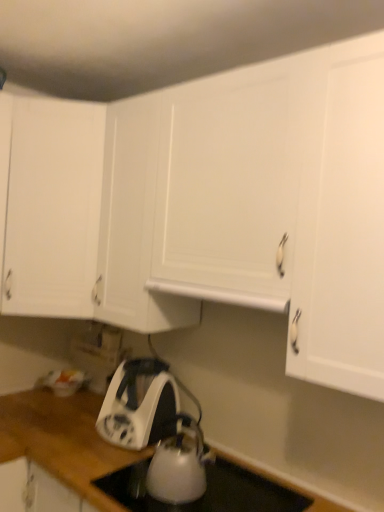
What do you see at coordinates (206, 490) in the screenshot? The image size is (384, 512). I see `white glossy kettle at lower center` at bounding box center [206, 490].

At what (x,y) coordinates should I click in order to perform the action: click on white matte cabinet at upper left. Please return your answer as a coordinate pair (x, y). The image size is (384, 512). Looking at the image, I should click on (52, 208).

Identify the location of white matte exhaust hood at center. (219, 295).

Where is `white glossy kettle at lower center`? The image size is (384, 512). white glossy kettle at lower center is located at coordinates (206, 490).

Looking at their sizes, would you say white matte cabinet at upper left is wider or thinner than white glossy kettle at lower center?

Clearly, white matte cabinet at upper left has more width compared to white glossy kettle at lower center.

Where is `gas stove on the right of white matte cabinet at upper left`? gas stove on the right of white matte cabinet at upper left is located at coordinates (206, 490).

Does white matte cabinet at upper left have a smaller size compared to white glossy kettle at lower center?

No.

Is point (89, 317) closer to camera compared to point (207, 493)?

No.

How different are the orientations of white glossy kettle at lower center and white matte cabinet at upper left in degrees?

The facing directions of white glossy kettle at lower center and white matte cabinet at upper left are 46.4 degrees apart.

Does point (183, 480) lie behind point (34, 189)?

No, it is in front of (34, 189).

Based on their positions, is white glossy kettle at lower center located to the left or right of white matte cabinet at upper left?

white glossy kettle at lower center is to the right of white matte cabinet at upper left.

Measure the distance from white glossy kettle at lower center to white matte cabinet at upper left.

white glossy kettle at lower center is 93.34 centimeters from white matte cabinet at upper left.

Between white glossy electric kettle at lower center and white glossy kettle at lower center, which one is positioned behind?

white glossy electric kettle at lower center is further from the camera.

From a real-world perspective, is white glossy electric kettle at lower center under white glossy kettle at lower center?

Incorrect, from a real-world perspective, white glossy electric kettle at lower center is higher than white glossy kettle at lower center.

Are white glossy electric kettle at lower center and white glossy kettle at lower center located far from each other?

No.

The width and height of the screenshot is (384, 512). Identify the location of exhaust hood above the white glossy electric kettle at lower center (from a real-world perspective). (219, 295).

Can you confirm if white glossy electric kettle at lower center is wider than white matte exhaust hood at center?

No.

From a real-world perspective, which is physically below, white glossy electric kettle at lower center or white matte exhaust hood at center?

white glossy electric kettle at lower center.

Which is in front, point (105, 401) or point (249, 301)?

Point (249, 301)

Is white matte cabinet at upper left to the right of white glossy electric kettle at lower center from the viewer's perspective?

No, white matte cabinet at upper left is not to the right of white glossy electric kettle at lower center.

Who is smaller, white matte cabinet at upper left or white glossy electric kettle at lower center?

white glossy electric kettle at lower center is smaller.

Considering the points (91, 104) and (155, 407), which point is behind, point (91, 104) or point (155, 407)?

The point (91, 104) is farther.

Could you tell me if white matte cabinet at upper left is turned towards white glossy electric kettle at lower center?

No, white matte cabinet at upper left does not turn towards white glossy electric kettle at lower center.

This screenshot has width=384, height=512. In order to click on exhaust hood above the white glossy kettle at lower center (from the image's perspective) in this screenshot , I will do `click(219, 295)`.

Is white glossy kettle at lower center outside of white matte exhaust hood at center?

Absolutely, white glossy kettle at lower center is external to white matte exhaust hood at center.

Consider the image. Between white glossy kettle at lower center and white matte exhaust hood at center, which one has less height?

white matte exhaust hood at center.

Looking at this image, from a real-world perspective, is white glossy kettle at lower center on top of white matte exhaust hood at center?

No, from a real-world perspective, white glossy kettle at lower center is not on top of white matte exhaust hood at center.

Is white glossy electric kettle at lower center at the back of white glossy kettle at lower center?

Answer: No.

Looking at this image, who is bigger, white glossy kettle at lower center or white glossy electric kettle at lower center?

white glossy electric kettle at lower center is bigger.

Locate an element on the screen. The width and height of the screenshot is (384, 512). gas stove on the right of the white matte cabinet at upper left is located at coordinates (206, 490).

Locate an element on the screen. This screenshot has width=384, height=512. cabinetry above the white glossy kettle at lower center (from the image's perspective) is located at coordinates (52, 208).

Which object lies further to the anchor point white glossy electric kettle at lower center, white glossy kettle at lower center or white glossy kettle at lower center?

white glossy kettle at lower center.

Looking at the image, which one is located further to white glossy electric kettle at lower center, white matte cabinet at upper left or white glossy kettle at lower center?

Among the two, white matte cabinet at upper left is located further to white glossy electric kettle at lower center.

From the image, which object appears to be nearer to white matte exhaust hood at center, white glossy kettle at lower center or white glossy electric kettle at lower center?

Based on the image, white glossy electric kettle at lower center appears to be nearer to white matte exhaust hood at center.

From the image, which object appears to be nearer to white glossy kettle at lower center, white glossy kettle at lower center or white matte exhaust hood at center?

Based on the image, white glossy kettle at lower center appears to be nearer to white glossy kettle at lower center.

From the picture: Based on their spatial positions, is white matte cabinet at upper left or white glossy kettle at lower center further from white matte exhaust hood at center?

The object further to white matte exhaust hood at center is white matte cabinet at upper left.

Based on their spatial positions, is white matte cabinet at upper left or white glossy electric kettle at lower center further from white glossy kettle at lower center?

white matte cabinet at upper left is positioned further to the anchor white glossy kettle at lower center.

Based on their spatial positions, is white glossy electric kettle at lower center or white glossy kettle at lower center further from white glossy kettle at lower center?

The object further to white glossy kettle at lower center is white glossy electric kettle at lower center.

Based on their spatial positions, is white glossy electric kettle at lower center or white matte exhaust hood at center closer to white glossy kettle at lower center?

white glossy electric kettle at lower center lies closer to white glossy kettle at lower center than the other object.

I want to click on exhaust hood between white matte cabinet at upper left and white glossy kettle at lower center in the up-down direction, so click(x=219, y=295).

I want to click on home appliance between white matte exhaust hood at center and white glossy kettle at lower center vertically, so click(139, 405).

Locate an element on the screen. kitchen appliance between white matte exhaust hood at center and white glossy kettle at lower center in the up-down direction is located at coordinates pyautogui.click(x=179, y=466).

At what (x,y) coordinates should I click in order to perform the action: click on home appliance between white matte exhaust hood at center and white glossy kettle at lower center in the up-down direction. Please return your answer as a coordinate pair (x, y). Looking at the image, I should click on (139, 405).